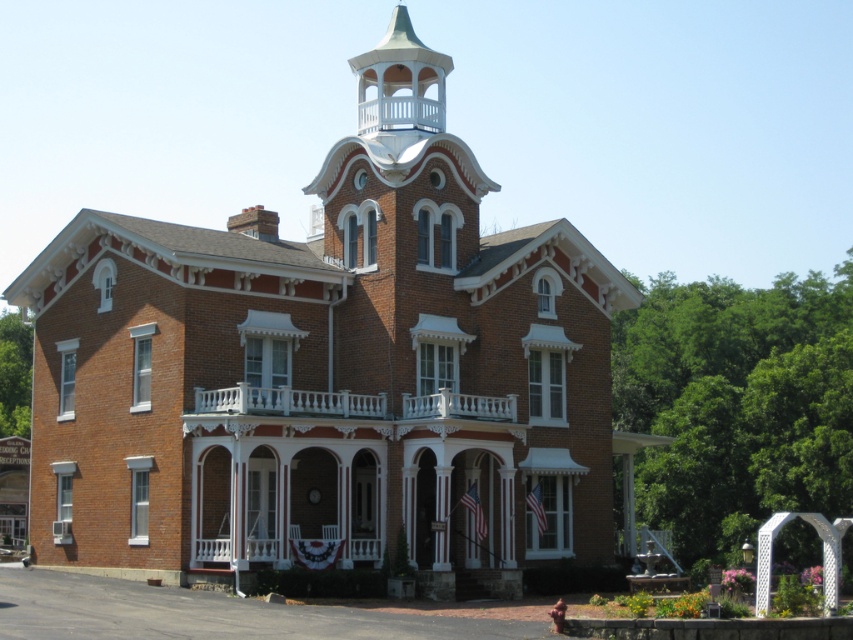
Does brick house at center come behind white painted wood spire at upper center?

That is False.

Is brick house at center above white painted wood spire at upper center?

Incorrect, brick house at center is not positioned above white painted wood spire at upper center.

Does point (497, 500) come closer to viewer compared to point (386, 80)?

Yes, it is.

Where is `brick house at center`? brick house at center is located at coordinates (325, 380).

Does brick house at center appear under white carved wood porch at center?

Actually, brick house at center is above white carved wood porch at center.

Identify the location of brick house at center. (325, 380).

Can you confirm if white painted wood spire at upper center is smaller than white carved wood porch at center?

No, white painted wood spire at upper center is not smaller than white carved wood porch at center.

Is point (408, 20) farther from viewer compared to point (410, 413)?

Yes.

Is point (410, 32) positioned behind point (287, 387)?

Yes.

The width and height of the screenshot is (853, 640). What are the coordinates of `white painted wood spire at upper center` in the screenshot? It's located at (399, 81).